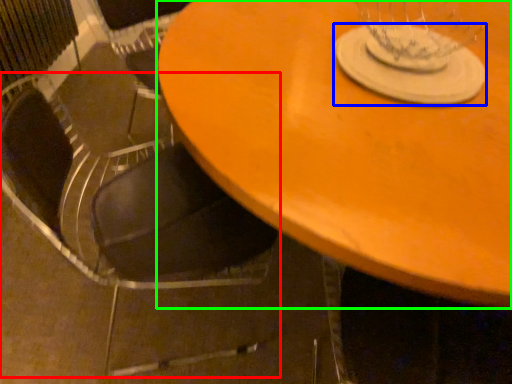
Question: Estimate the real-world distances between objects in this image. Which object is farther from chair (highlighted by a red box), glass plate (highlighted by a blue box) or table (highlighted by a green box)?

Choices:
 (A) glass plate
 (B) table

Answer: (A)